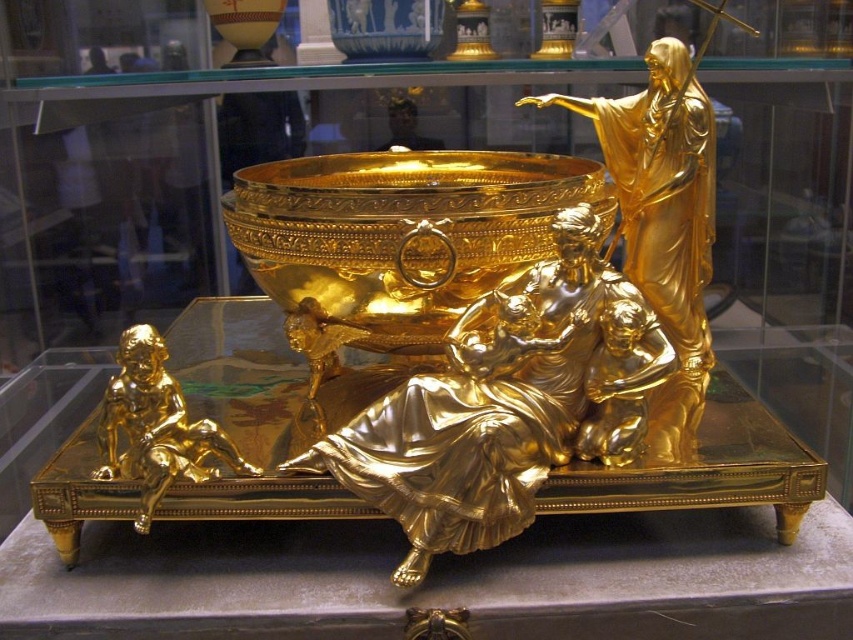
Question: Among these points, which one is nearest to the camera?

Choices:
 (A) (117, 388)
 (B) (582, 385)

Answer: (A)

Question: Is the position of gold polished statue at center more distant than that of gold polished cherub at lower left?

Choices:
 (A) yes
 (B) no

Answer: (A)

Question: Which of the following is the farthest from the observer?

Choices:
 (A) (469, 397)
 (B) (170, 467)

Answer: (A)

Question: Does gold polished statue at center have a smaller size compared to gold polished cherub at lower left?

Choices:
 (A) yes
 (B) no

Answer: (B)

Question: Is gold polished statue at center thinner than gold polished cherub at lower left?

Choices:
 (A) no
 (B) yes

Answer: (A)